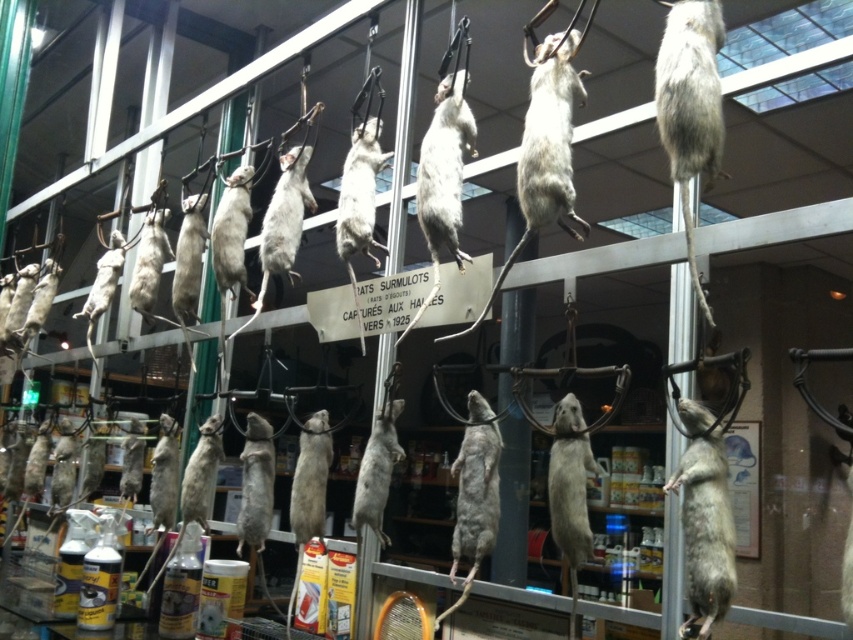
Question: In this image, where is fuzzy gray mouse at center located relative to gray fur mouse at center?

Choices:
 (A) right
 (B) left

Answer: (A)

Question: Which object is the farthest from the gray matte mouse at upper center?

Choices:
 (A) fuzzy gray mouse at center
 (B) gray fur mouse at center

Answer: (B)

Question: From the image, what is the correct spatial relationship of gray matte mouse at upper center in relation to fuzzy gray mouse at center?

Choices:
 (A) right
 (B) left

Answer: (A)

Question: Which of the following is the closest to the observer?

Choices:
 (A) gray matte mouse at upper center
 (B) fuzzy gray mouse at center
 (C) gray fur mouse at center

Answer: (B)

Question: Does gray matte mouse at upper center appear on the right side of fuzzy gray mouse at center?

Choices:
 (A) yes
 (B) no

Answer: (A)

Question: Which object is farther from the camera taking this photo?

Choices:
 (A) fuzzy gray mouse at center
 (B) gray fur mouse at center

Answer: (B)